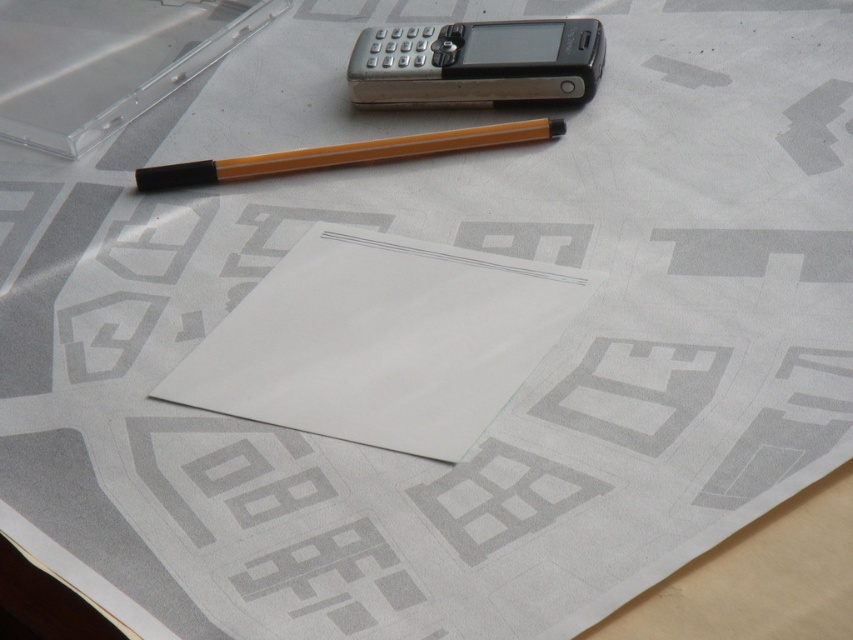
From the picture: You are an architect reviewing a blueprint and need to make a quick note. You have a yellow striped pencil at center and a rubber eraser at center. Which object is closer to the top edge of the blueprint?

The rubber eraser at center is closer to the top edge of the blueprint because the yellow striped pencil at center is located below it.

You are an architect working on a blueprint and need to choose between the yellow striped pencil at center and the rubber eraser at center for a task. If the task requires using the larger item, which one should you pick?

The yellow striped pencil at center is larger in size than the rubber eraser at center, so you should pick the yellow striped pencil at center for the task.

You are an architect working on a blueprint. You need to place a new object between the silver metallic smartphone at center and the yellow striped pencil at center. Based on their positions, which object is on the left side where you should start?

The yellow striped pencil at center is on the left side, so you should start placing the new object next to it.